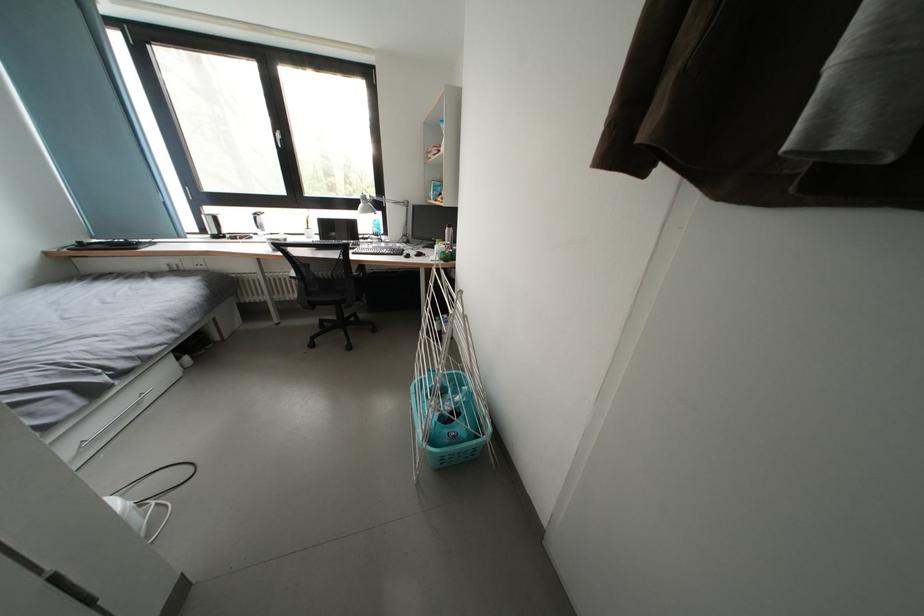
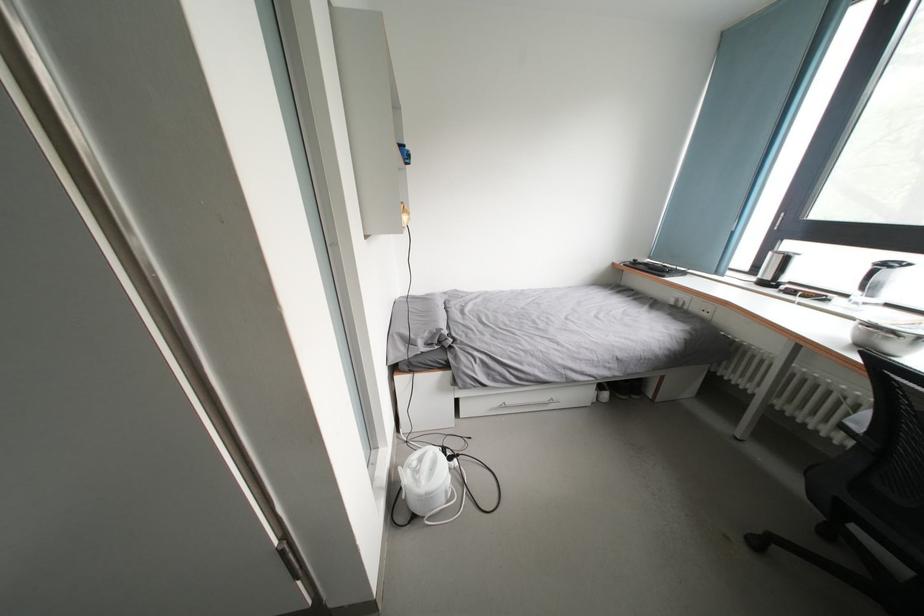
Where in the second image is the point corresponding to (x=223, y=238) from the first image?

(774, 283)